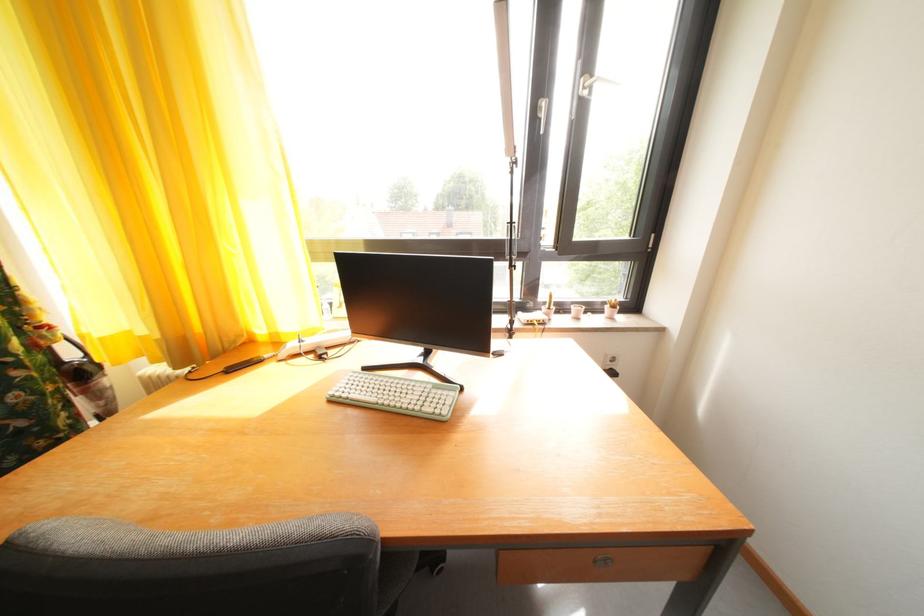
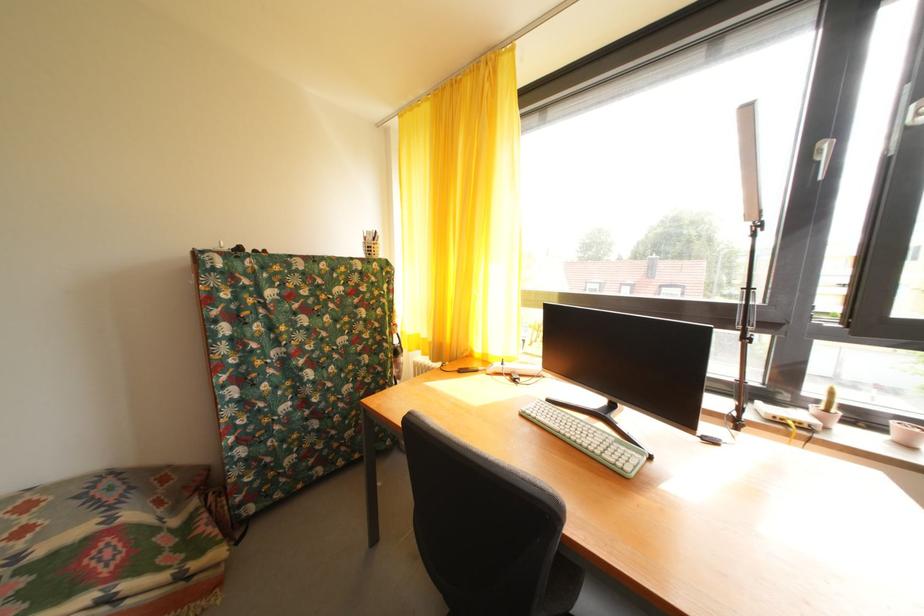
The point at (x=581, y=313) is marked in the first image. Where is the corresponding point in the second image?

(904, 430)